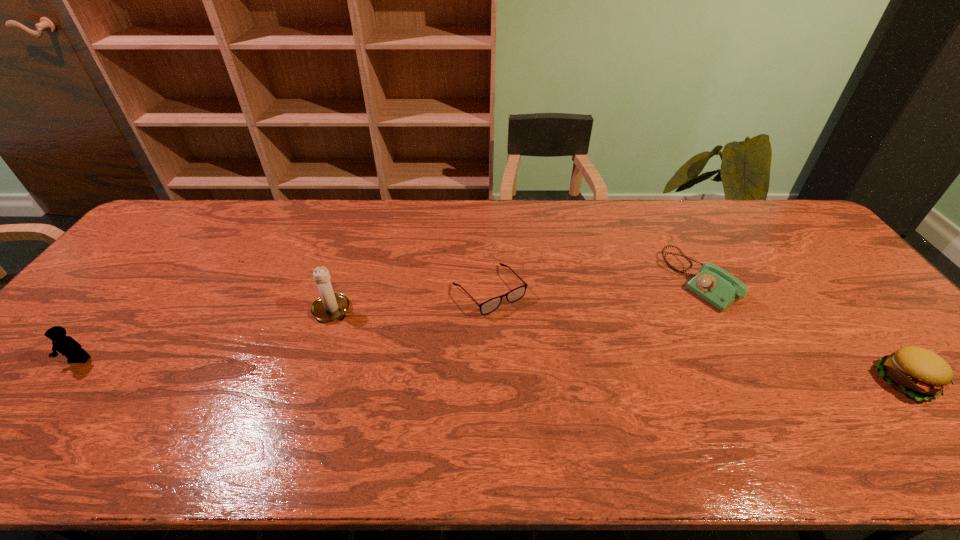
Find the location of a particular element. object present at the near edge is located at coordinates (917, 372).

Locate an element on the screen. object that is positioned at the left edge is located at coordinates (67, 346).

Image resolution: width=960 pixels, height=540 pixels. I want to click on object located at the right edge, so click(917, 372).

At what (x,y) coordinates should I click in order to perform the action: click on object located in the near right corner section of the desktop. Please return your answer as a coordinate pair (x, y). The height and width of the screenshot is (540, 960). Looking at the image, I should click on (917, 372).

At what (x,y) coordinates should I click in order to perform the action: click on free spot at the far edge of the desktop. Please return your answer as a coordinate pair (x, y). Looking at the image, I should click on (221, 204).

The image size is (960, 540). What are the coordinates of `free space at the near edge` in the screenshot? It's located at (380, 406).

Identify the location of vacant space at the left edge of the desktop. The width and height of the screenshot is (960, 540). (95, 293).

This screenshot has width=960, height=540. In the image, there is a desktop. In order to click on vacant space at the right edge in this screenshot , I will do `click(849, 296)`.

Image resolution: width=960 pixels, height=540 pixels. In the image, there is a desktop. What are the coordinates of `vacant space at the far left corner` in the screenshot? It's located at (156, 232).

In the image, there is a desktop. Find the location of `vacant space at the far right corner`. vacant space at the far right corner is located at coordinates (807, 238).